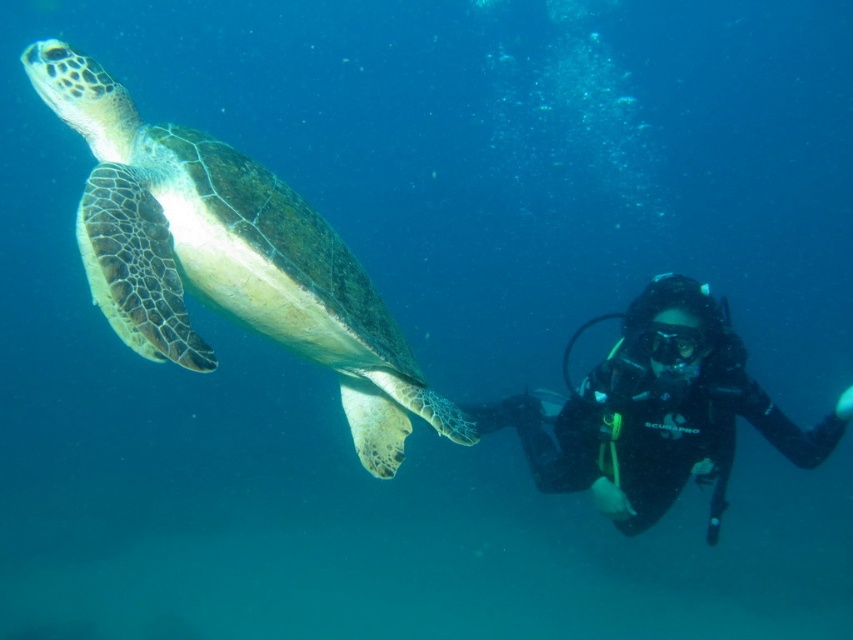
You are a marine biologist observing an underwater scene. You notice the green textured shell at left and the black rubber diving suit at right. Based on their positions in the water, which object is higher in the water column?

The green textured shell at left is located above the black rubber diving suit at right, so it is higher in the water column.

You are a scuba diver trying to reach a treasure chest located at point A and point B in the underwater scene. The coordinates for point A are point (82,196) and point B are point (633,323). Which point is closer to you so you can reach it first?

Point (82,196) is closer to the viewer than point (633,323), so you can reach point A first.